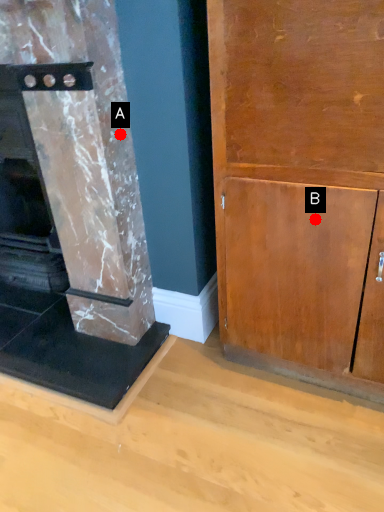
Question: Two points are circled on the image, labeled by A and B beside each circle. Among these points, which one is nearest to the camera?

Choices:
 (A) A is closer
 (B) B is closer

Answer: (B)